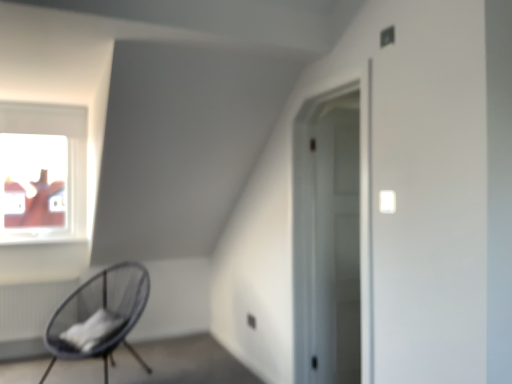
Question: Is point (357, 243) positioned closer to the camera than point (54, 306)?

Choices:
 (A) farther
 (B) closer

Answer: (B)

Question: Visually, is white matte door at center positioned to the left or to the right of white textured radiator at lower left?

Choices:
 (A) left
 (B) right

Answer: (B)

Question: Estimate the real-world distances between objects in this image. Which object is farther from the black mesh chair at lower left?

Choices:
 (A) white textured radiator at lower left
 (B) white matte door at center

Answer: (B)

Question: Which object is the closest to the white textured radiator at lower left?

Choices:
 (A) black mesh chair at lower left
 (B) white matte door at center

Answer: (A)